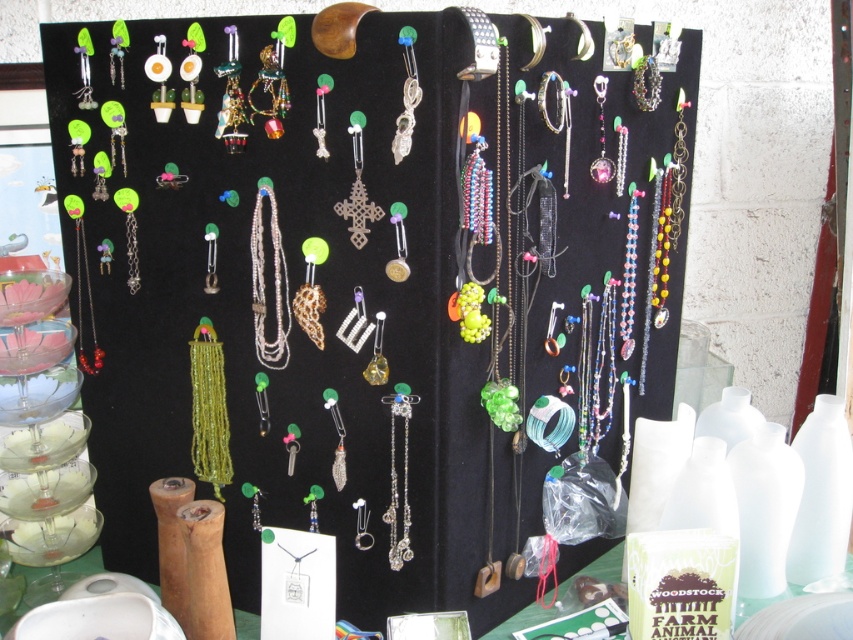
Question: Considering the real-world distances, which object is farthest from the green beaded necklace at center?

Choices:
 (A) clear crystal pendant at center
 (B) silver metallic chain at center

Answer: (A)

Question: Does silver metallic chain at center lie in front of clear crystal pendant at center?

Choices:
 (A) no
 (B) yes

Answer: (A)

Question: Is silver metallic chain at center wider than clear crystal pendant at center?

Choices:
 (A) no
 (B) yes

Answer: (B)

Question: Which object appears farthest from the camera in this image?

Choices:
 (A) clear crystal pendant at center
 (B) silver metallic chain at center
 (C) green beaded necklace at center

Answer: (C)

Question: From the image, what is the correct spatial relationship of green beaded necklace at center in relation to clear crystal pendant at center?

Choices:
 (A) below
 (B) above

Answer: (B)

Question: Which point appears farthest from the camera in this image?

Choices:
 (A) (254, 208)
 (B) (213, 428)

Answer: (B)